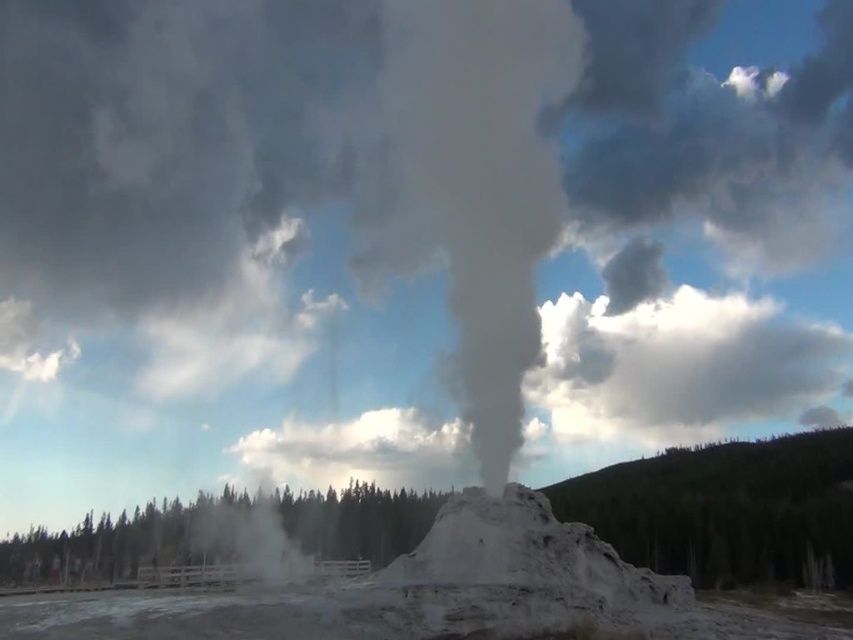
You are a photographer planning to capture the white smoke at center and the green wood trees at lower center in a single shot. Based on their relative sizes in the image, which object would appear taller in the photograph?

The white smoke at center appears taller than the green wood trees at lower center in the photograph because it has a greater height compared to them.

You are a park ranger at Yellowstone National Park and you need to determine if the gray cloudy smoke at center is coming from Castle Geyser. Based on the coordinates provided, can you confirm if the gray cloudy smoke at center is located at point [477,182]?

Yes, the gray cloudy smoke at center is located at point [477,182] as described.